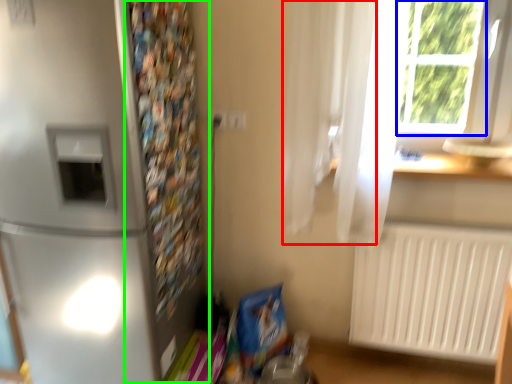
Question: Estimate the real-world distances between objects in this image. Which object is closer to curtain (highlighted by a red box), window frame (highlighted by a blue box) or bulletin board (highlighted by a green box)?

Choices:
 (A) window frame
 (B) bulletin board

Answer: (A)